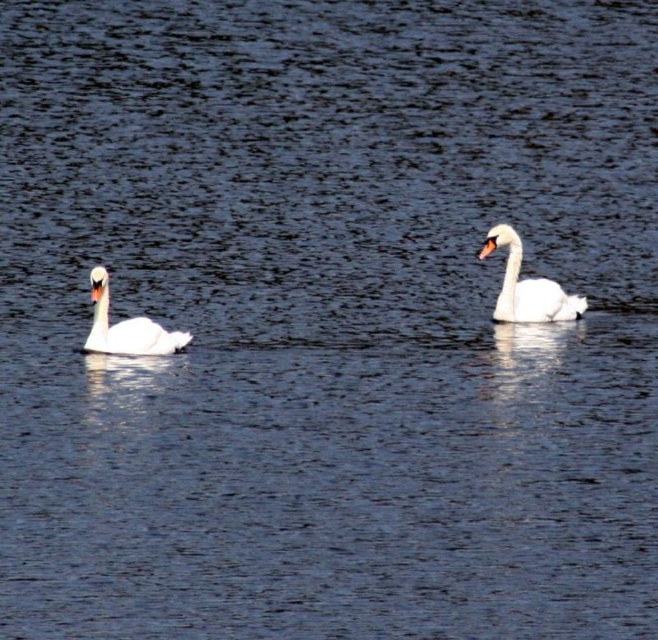
You are standing on a wooden pier observing the white glossy swan at right. You want to toss a small bread roll to the swan. The bread roll has a diameter of 5 cm. Can you estimate if the bread roll will reach the swan if you throw it with a force that can project it 10 meters?

The white glossy swan at right is 11.17 meters away from the viewer. Since the bread roll can only be thrown 10 meters, it will not reach the swan.

You are standing on the edge of the water and see the white glossy swan at right and the white matte swan at left. If you want to throw a small pebble to make a splash between them, how far apart are the two swans?

The white glossy swan at right is 7.54 feet away from the white matte swan at left, so the distance between them is 7.54 feet.

Based on the photo, you are a photographer trying to capture the white glossy swan at right. You want to position your camera at the center of the image. What coordinates should you aim for to ensure the swan is in the frame?

The white glossy swan at right is located at coordinates point (526,285). To ensure it is in the frame, aim the camera at the center point between the swan and the image edges, but since the question specifies positioning at the center of the image, the camera should be aimed at the center coordinates, which are typically at point (329,320). However, since the swan is at (526,285), adjusting slightly towards its position might be necessary for optimal framing.